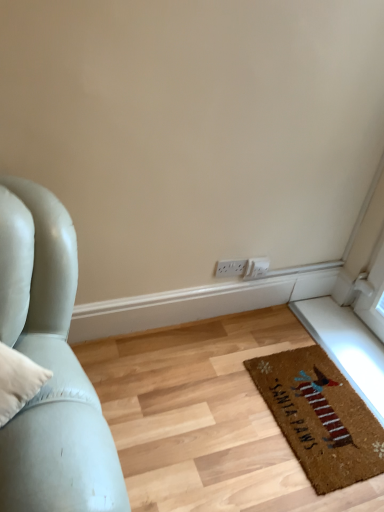
The image size is (384, 512). Find the location of `empty space that is ontop of brown coir mat at lower right (from a real-world perspective)`. empty space that is ontop of brown coir mat at lower right (from a real-world perspective) is located at coordinates (328, 407).